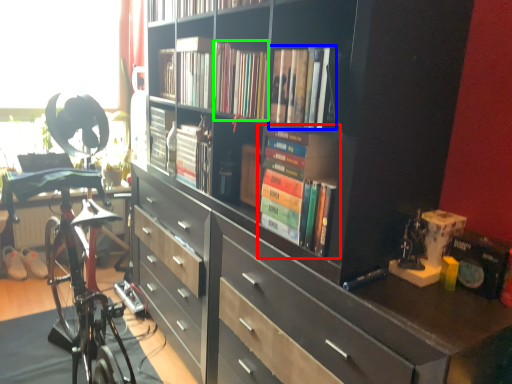
Question: Which object is the farthest from book (highlighted by a red box)? Choose among these: book (highlighted by a blue box) or book (highlighted by a green box).

Choices:
 (A) book
 (B) book

Answer: (B)